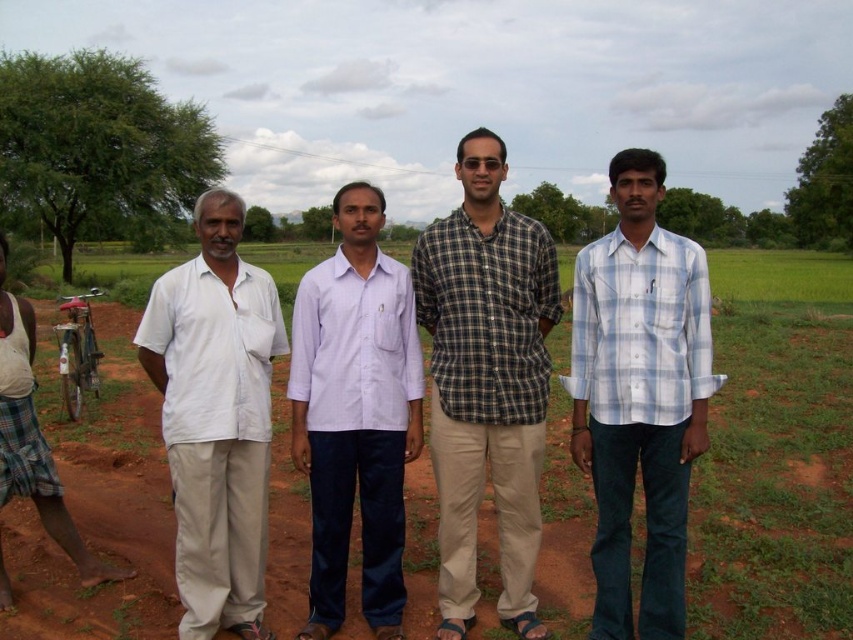
Does light blue plaid shirt at center have a larger size compared to light purple cotton shirt at center?

Yes, light blue plaid shirt at center is bigger than light purple cotton shirt at center.

Is light blue plaid shirt at center thinner than light purple cotton shirt at center?

In fact, light blue plaid shirt at center might be wider than light purple cotton shirt at center.

Find the location of a particular element. light blue plaid shirt at center is located at coordinates (639, 396).

Who is positioned more to the right, white cotton shirt at left or light purple cotton shirt at center?

From the viewer's perspective, light purple cotton shirt at center appears more on the right side.

Does white cotton shirt at left lie in front of light purple cotton shirt at center?

Yes, white cotton shirt at left is in front of light purple cotton shirt at center.

Describe the element at coordinates (216, 417) in the screenshot. I see `white cotton shirt at left` at that location.

Find the location of a particular element. This screenshot has width=853, height=640. white cotton shirt at left is located at coordinates (216, 417).

Can you confirm if brown dirt field at center is smaller than light blue plaid shirt at center?

No.

Is point (119, 342) closer to viewer compared to point (701, 349)?

No, (119, 342) is further to viewer.

Image resolution: width=853 pixels, height=640 pixels. Find the location of `brown dirt field at center`. brown dirt field at center is located at coordinates (775, 484).